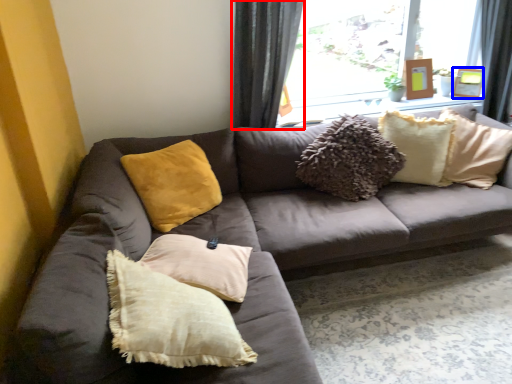
Question: Among these objects, which one is nearest to the camera, curtain (highlighted by a red box) or picture frame (highlighted by a blue box)?

Choices:
 (A) curtain
 (B) picture frame

Answer: (A)